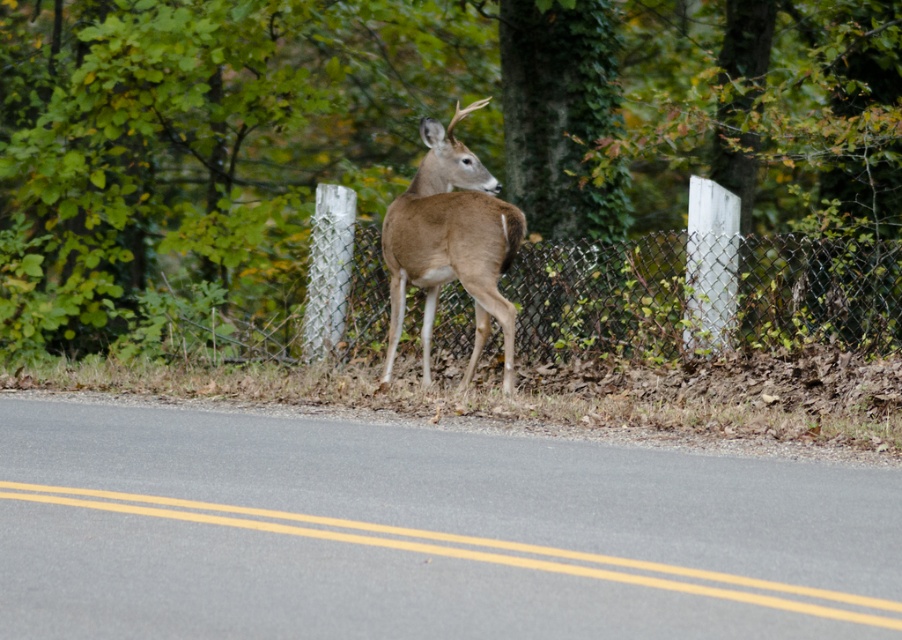
Question: Is the position of metallic chain-link fence at center less distant than that of brown matte deer at center?

Choices:
 (A) yes
 (B) no

Answer: (B)

Question: Which of the following is the closest to the observer?

Choices:
 (A) (341, 228)
 (B) (384, 220)

Answer: (B)

Question: Which of the following is the closest to the observer?

Choices:
 (A) brown matte deer at center
 (B) metallic chain-link fence at center

Answer: (A)

Question: Is metallic chain-link fence at center closer to camera compared to brown matte deer at center?

Choices:
 (A) yes
 (B) no

Answer: (B)

Question: Does metallic chain-link fence at center appear on the left side of brown matte deer at center?

Choices:
 (A) yes
 (B) no

Answer: (B)